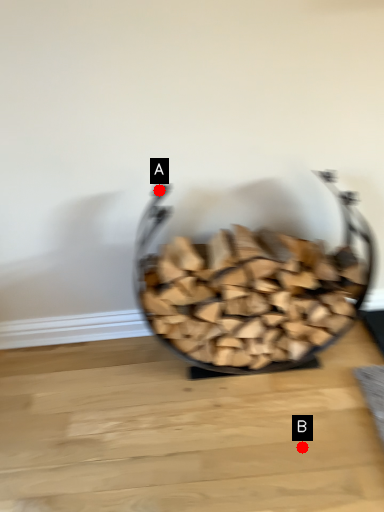
Question: Two points are circled on the image, labeled by A and B beside each circle. Which point appears farthest from the camera in this image?

Choices:
 (A) A is further
 (B) B is further

Answer: (A)